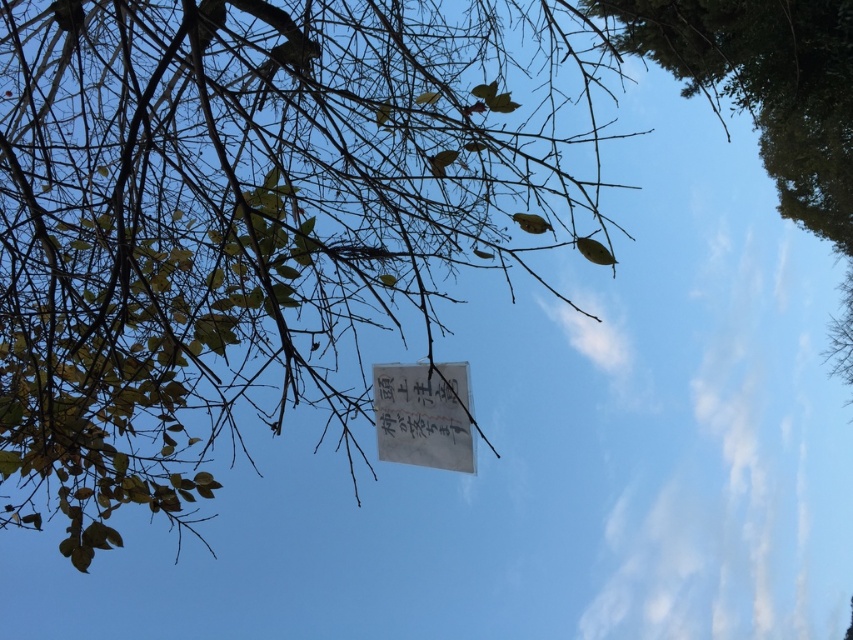
Consider the image. You are a bird flying near the white paper at center and the green leafy tree at upper right. Which object is closer to you when you look down?

The white paper at center is closer to you because it is smaller in size compared to the green leafy tree at upper right, which suggests it is farther away.

I see two white objects in the center of the image. One is labeled as white paper at center and the other as white paper sign at center. Which one is wider?

The white paper at center is wider than the white paper sign at center according to the description.